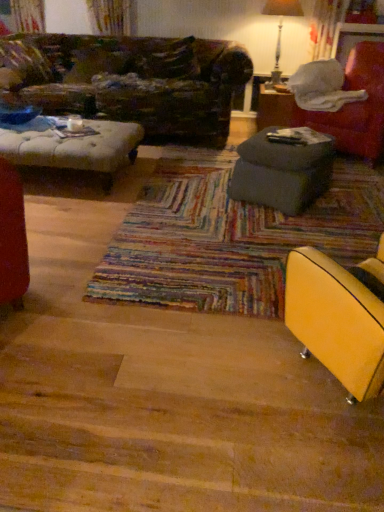
Question: From the image's perspective, would you say metallic silver table lamp at upper right is shown under gray fabric ottoman at right, which is the first table in front-to-back order?

Choices:
 (A) no
 (B) yes

Answer: (A)

Question: From a real-world perspective, does metallic silver table lamp at upper right stand above gray fabric ottoman at right, which is the second table in back-to-front order?

Choices:
 (A) no
 (B) yes

Answer: (B)

Question: Does metallic silver table lamp at upper right lie behind gray fabric ottoman at right, which is the first table in front-to-back order?

Choices:
 (A) yes
 (B) no

Answer: (A)

Question: Can you confirm if metallic silver table lamp at upper right is positioned to the right of gray fabric ottoman at right, positioned as the first table in bottom-to-top order?

Choices:
 (A) no
 (B) yes

Answer: (B)

Question: From the image's perspective, would you say metallic silver table lamp at upper right is positioned over gray fabric ottoman at right, which is the second table in back-to-front order?

Choices:
 (A) no
 (B) yes

Answer: (B)

Question: Is point (299, 110) positioned closer to the camera than point (329, 311)?

Choices:
 (A) farther
 (B) closer

Answer: (A)

Question: Looking at the image, does matte gray ottoman at center, the 1th table when ordered from top to bottom, seem bigger or smaller compared to yellow leather chair at lower right, the 2th chair from the top?

Choices:
 (A) big
 (B) small

Answer: (B)

Question: Is matte gray ottoman at center, the 1th table when ordered from top to bottom, in front of or behind yellow leather chair at lower right, which ranks as the 1th chair in left-to-right order, in the image?

Choices:
 (A) behind
 (B) front

Answer: (A)

Question: Based on their positions, is matte gray ottoman at center, the 1th table when ordered from top to bottom, located to the left or right of yellow leather chair at lower right, which ranks as the 1th chair in left-to-right order?

Choices:
 (A) right
 (B) left

Answer: (A)

Question: Looking at their shapes, would you say velvet red armchair at right, which is the 2th chair in bottom-to-top order, is wider or thinner than metallic silver table lamp at upper right?

Choices:
 (A) wide
 (B) thin

Answer: (A)

Question: Considering the positions of point (359, 133) and point (276, 2), is point (359, 133) closer or farther from the camera than point (276, 2)?

Choices:
 (A) farther
 (B) closer

Answer: (B)

Question: In the image, is velvet red armchair at right, which ranks as the second chair in left-to-right order, on the left side or the right side of metallic silver table lamp at upper right?

Choices:
 (A) left
 (B) right

Answer: (B)

Question: From the image's perspective, is velvet red armchair at right, which ranks as the second chair in left-to-right order, above or below metallic silver table lamp at upper right?

Choices:
 (A) below
 (B) above

Answer: (A)

Question: From the image's perspective, is metallic silver table lamp at upper right positioned above or below gray fabric ottoman at right, positioned as the first table in bottom-to-top order?

Choices:
 (A) above
 (B) below

Answer: (A)

Question: Is metallic silver table lamp at upper right spatially inside gray fabric ottoman at right, which is the second table in back-to-front order, or outside of it?

Choices:
 (A) inside
 (B) outside

Answer: (B)